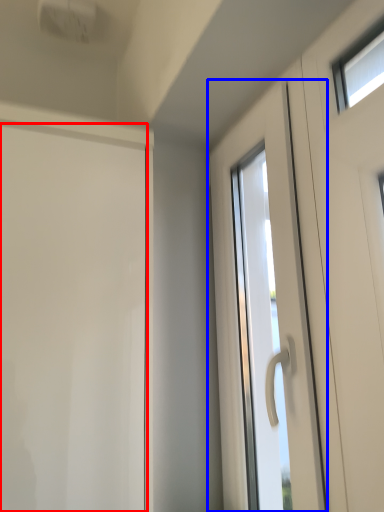
Question: Among these objects, which one is nearest to the camera, door (highlighted by a red box) or door (highlighted by a blue box)?

Choices:
 (A) door
 (B) door

Answer: (A)